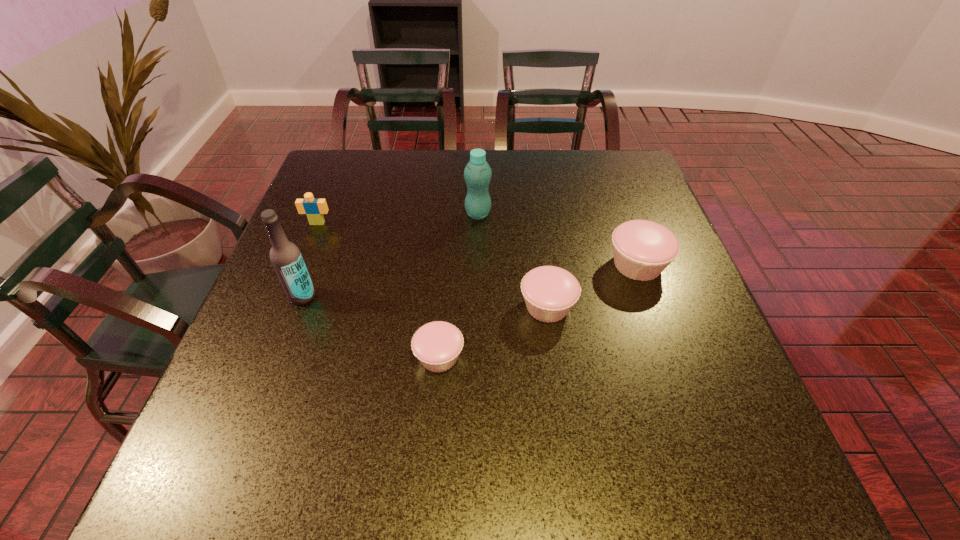
Identify the location of free space between the nearest object and the Lego. The height and width of the screenshot is (540, 960). (378, 290).

You are a GUI agent. You are given a task and a screenshot of the screen. Output one action in this format:
    pyautogui.click(x=<x>, y=<y>)
    Task: Click on the free spot between the tallest object and the water bottle
    
    Given the screenshot: What is the action you would take?
    pyautogui.click(x=390, y=255)

In order to click on vacant area that lies between the tallest cupcake and the Lego in this screenshot , I will do `click(477, 244)`.

The image size is (960, 540). What are the coordinates of `free spot between the Lego and the rightmost cupcake` in the screenshot? It's located at (477, 244).

Where is `free area in between the Lego and the rightmost cupcake`? free area in between the Lego and the rightmost cupcake is located at coordinates (477, 244).

I want to click on object that stands as the fourth closest to the tallest cupcake, so click(285, 256).

Find the location of `object identified as the closest to the shortest cupcake`. object identified as the closest to the shortest cupcake is located at coordinates (550, 292).

You are a GUI agent. You are given a task and a screenshot of the screen. Output one action in this format:
    pyautogui.click(x=<x>, y=<y>)
    Task: Click on the second closest cupcake to the rightmost object
    This screenshot has height=540, width=960.
    Given the screenshot: What is the action you would take?
    pyautogui.click(x=437, y=345)

Locate which cupcake is the third closest to the beer bottle. Please provide its 2D coordinates. Your answer should be formatted as a tuple, i.e. [(x, y)], where the tuple contains the x and y coordinates of a point satisfying the conditions above.

[(642, 249)]

Where is `free point that satisfies the following two spatial constraints: 1. at the front cap of the water bottle; 2. on the face of the Lego`? This screenshot has height=540, width=960. free point that satisfies the following two spatial constraints: 1. at the front cap of the water bottle; 2. on the face of the Lego is located at coordinates (478, 223).